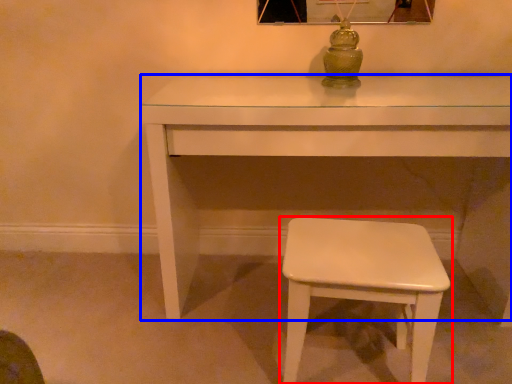
Question: Which of the following is the farthest to the observer, stool (highlighted by a red box) or table (highlighted by a blue box)?

Choices:
 (A) stool
 (B) table

Answer: (B)